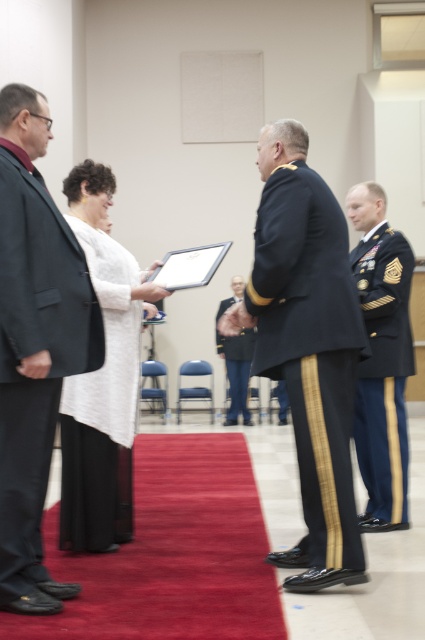
Which is more to the right, black matte suit at left or white matte jacket at center?

From the viewer's perspective, white matte jacket at center appears more on the right side.

Which is behind, point (40, 502) or point (110, 472)?

The point (110, 472) is behind.

Image resolution: width=425 pixels, height=640 pixels. Identify the location of black matte suit at left. (34, 346).

Who is lower down, navy blue fabric uniform at center or dark green military uniform at right?

dark green military uniform at right

Find the location of a particular element. navy blue fabric uniform at center is located at coordinates (311, 348).

What are the coordinates of `navy blue fabric uniform at center` in the screenshot? It's located at (311, 348).

Which of these two, black matte suit at left or navy blue fabric uniform at center, stands shorter?

With less height is navy blue fabric uniform at center.

Is black matte suit at left below navy blue fabric uniform at center?

Incorrect, black matte suit at left is not positioned below navy blue fabric uniform at center.

Between point (39, 380) and point (314, 349), which one is positioned in front?

Point (39, 380)

You are a GUI agent. You are given a task and a screenshot of the screen. Output one action in this format:
    pyautogui.click(x=<x>, y=<y>)
    Task: Click on the black matte suit at left
    
    Given the screenshot: What is the action you would take?
    pyautogui.click(x=34, y=346)